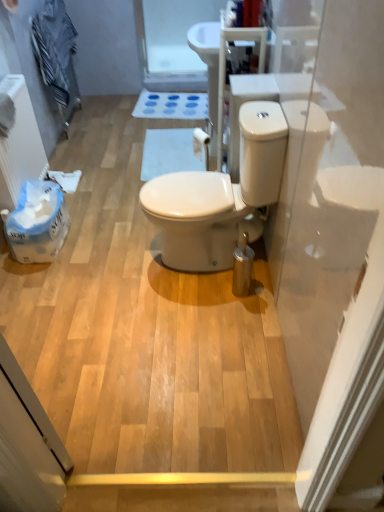
This screenshot has height=512, width=384. I want to click on vacant point to the right of white plastic radiator at left, so click(x=97, y=208).